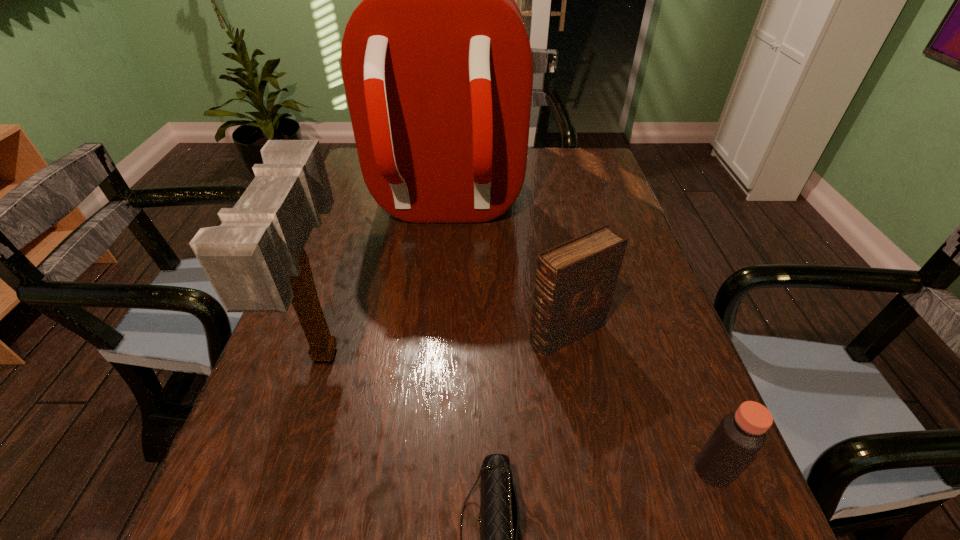
Identify the location of object positioned at the far edge. The image size is (960, 540). (437, 66).

Locate an element on the screen. The width and height of the screenshot is (960, 540). backpack located in the left edge section of the desktop is located at coordinates [x=437, y=66].

What are the coordinates of `mallet situated at the left edge` in the screenshot? It's located at (255, 260).

Locate an element on the screen. The image size is (960, 540). Bible that is at the right edge is located at coordinates (575, 281).

The image size is (960, 540). What are the coordinates of `vinegar at the right edge` in the screenshot? It's located at (740, 435).

Image resolution: width=960 pixels, height=540 pixels. What are the coordinates of `object located in the far left corner section of the desktop` in the screenshot? It's located at (437, 66).

In the image, there is a desktop. Identify the location of vacant space at the far edge. The width and height of the screenshot is (960, 540). (528, 160).

Locate an element on the screen. This screenshot has height=540, width=960. vacant space at the left edge of the desktop is located at coordinates (322, 246).

The width and height of the screenshot is (960, 540). In the image, there is a desktop. In order to click on vacant area at the right edge in this screenshot , I will do pos(679,346).

Locate an element on the screen. The width and height of the screenshot is (960, 540). vacant space at the far right corner of the desktop is located at coordinates (593, 180).